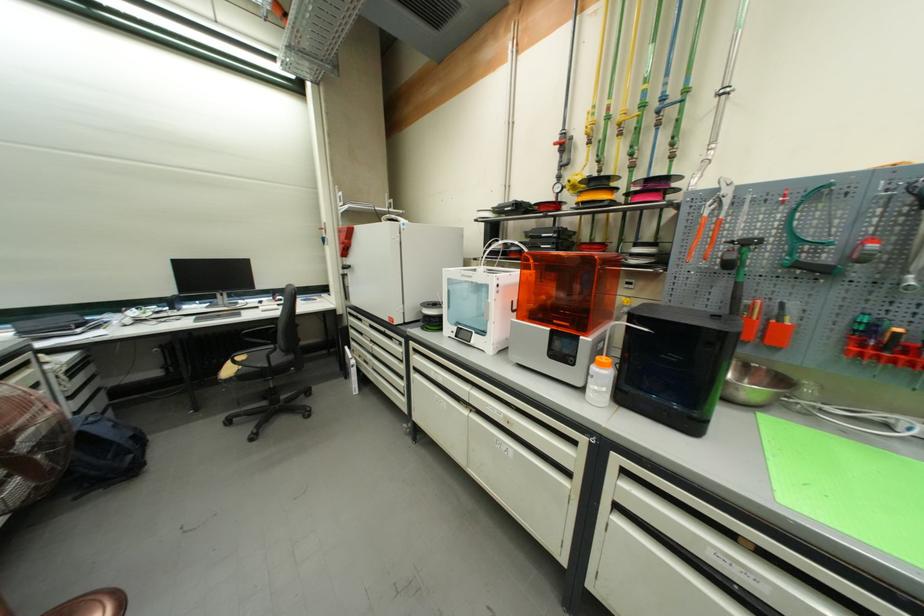
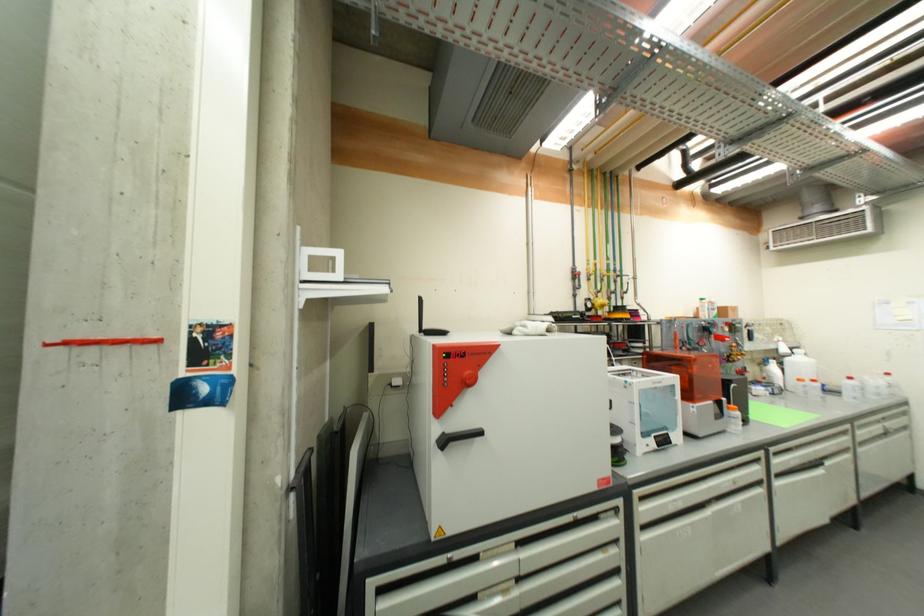
In the second image, find the point that corresponds to (606,367) in the first image.

(739, 411)